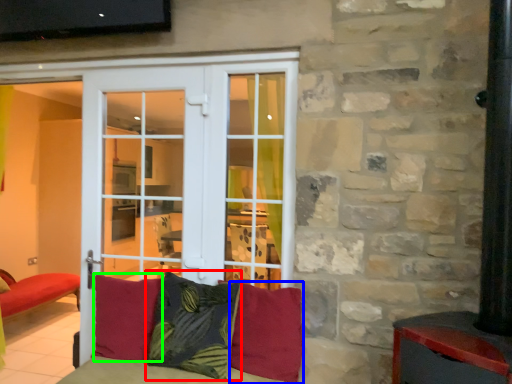
Question: Which is farther away from pillow (highlighted by a red box)? pillow (highlighted by a blue box) or pillow (highlighted by a green box)?

Choices:
 (A) pillow
 (B) pillow

Answer: (B)